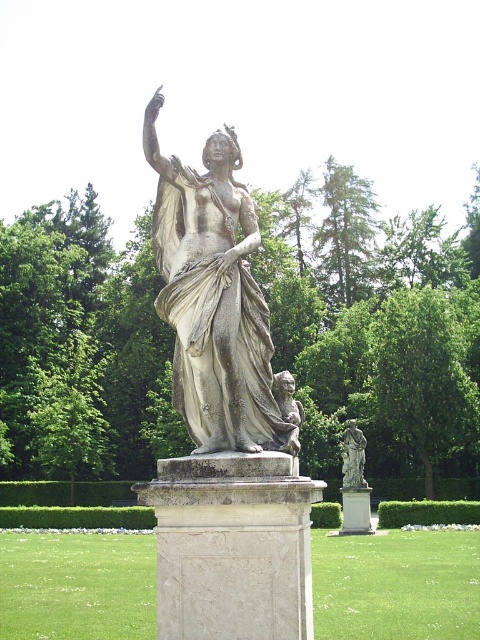
Does matte gray statue at center have a greater height compared to white marble pillar at center?

Yes, matte gray statue at center is taller than white marble pillar at center.

Does matte gray statue at center come behind white marble pillar at center?

No, it is not.

Find the location of a particular element. The image size is (480, 640). matte gray statue at center is located at coordinates (214, 298).

Which is more to the right, white marble statue at center or white marble pillar at center?

white marble pillar at center is more to the right.

Based on the photo, who is shorter, white marble statue at center or white marble pillar at center?

white marble pillar at center

Who is more forward, (357,452) or (361,513)?

Positioned in front is point (361,513).

Find the location of a particular element. This screenshot has height=640, width=480. white marble statue at center is located at coordinates (352, 456).

Can you confirm if matte gray statue at center is shorter than white marble statue at center?

Incorrect, matte gray statue at center's height does not fall short of white marble statue at center's.

Find the location of a particular element. The width and height of the screenshot is (480, 640). matte gray statue at center is located at coordinates (214, 298).

Where is `matte gray statue at center`? The image size is (480, 640). matte gray statue at center is located at coordinates (214, 298).